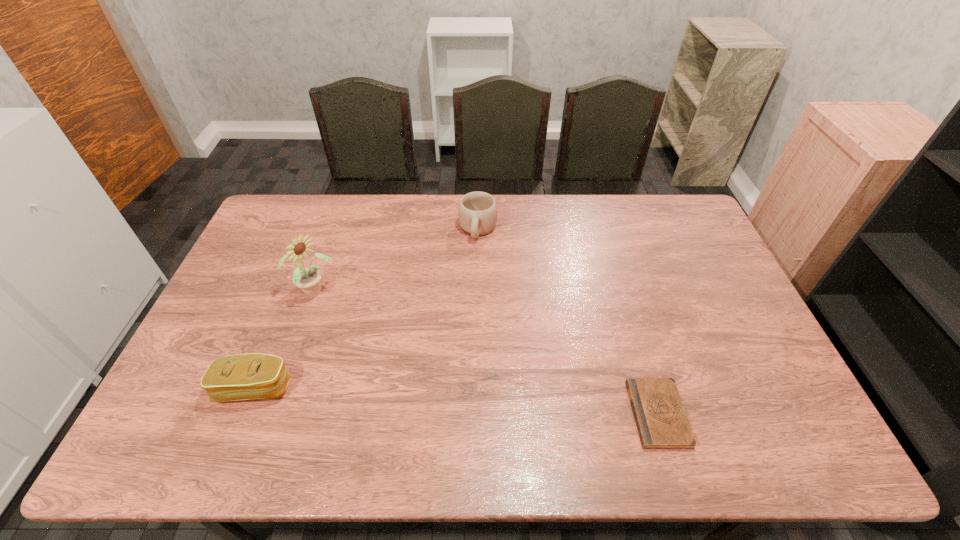
Where is `object that is at the near left corner`? This screenshot has width=960, height=540. object that is at the near left corner is located at coordinates (249, 376).

Locate an element on the screen. The height and width of the screenshot is (540, 960). blank space at the far edge of the desktop is located at coordinates (447, 228).

Where is `vacant region at the near edge`? vacant region at the near edge is located at coordinates (712, 410).

At what (x,y) coordinates should I click in order to perform the action: click on vacant space at the right edge. Please return your answer as a coordinate pair (x, y). The width and height of the screenshot is (960, 540). Looking at the image, I should click on (665, 253).

Image resolution: width=960 pixels, height=540 pixels. In the image, there is a desktop. Find the location of `vacant space at the near left corner`. vacant space at the near left corner is located at coordinates (214, 402).

In the image, there is a desktop. Where is `free space at the far right corner`? This screenshot has width=960, height=540. free space at the far right corner is located at coordinates (645, 197).

The image size is (960, 540). What are the coordinates of `vacant area at the near right corner of the desktop` in the screenshot? It's located at (762, 391).

At what (x,y) coordinates should I click in order to perform the action: click on unoccupied area between the sunflower and the clutch bag. Please return your answer as a coordinate pair (x, y). This screenshot has height=540, width=960. Looking at the image, I should click on (284, 340).

Locate an element on the screen. blank region between the diary and the sunflower is located at coordinates (486, 353).

This screenshot has height=540, width=960. I want to click on vacant space that's between the rightmost object and the tallest object, so click(486, 353).